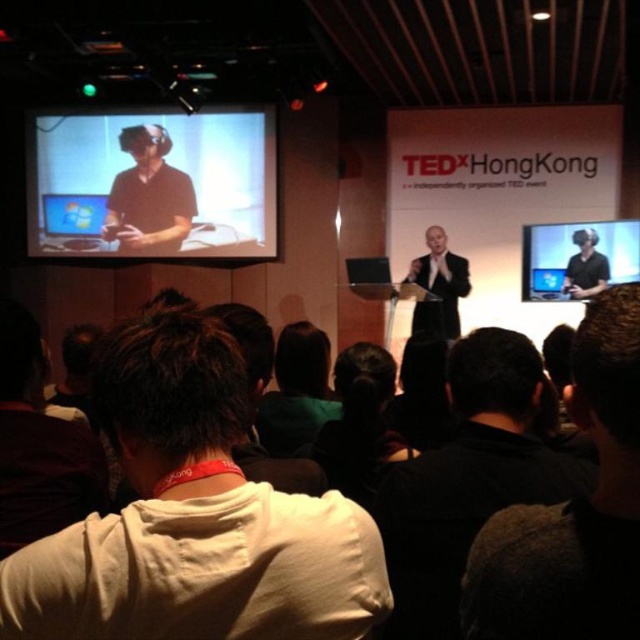
Can you confirm if matte black laptop at upper left is positioned below matte black vr headset at upper left?

No.

The height and width of the screenshot is (640, 640). What do you see at coordinates (152, 182) in the screenshot?
I see `matte black laptop at upper left` at bounding box center [152, 182].

Where is `matte black laptop at upper left`? The height and width of the screenshot is (640, 640). matte black laptop at upper left is located at coordinates (152, 182).

Between matte black vr headset at upper center and matte black laptop at upper center, which one is positioned lower?

matte black vr headset at upper center is below.

Measure the distance between point (598, 552) and camera.

Point (598, 552) and camera are 64.63 centimeters apart from each other.

Where is `matte black vr headset at upper center`? matte black vr headset at upper center is located at coordinates (573, 509).

Does white cotton hoodie at center have a greater width compared to matte black vr headset at upper left?

No, white cotton hoodie at center is not wider than matte black vr headset at upper left.

The image size is (640, 640). What do you see at coordinates (193, 516) in the screenshot? I see `white cotton hoodie at center` at bounding box center [193, 516].

Find the location of `white cotton hoodie at center`. white cotton hoodie at center is located at coordinates (193, 516).